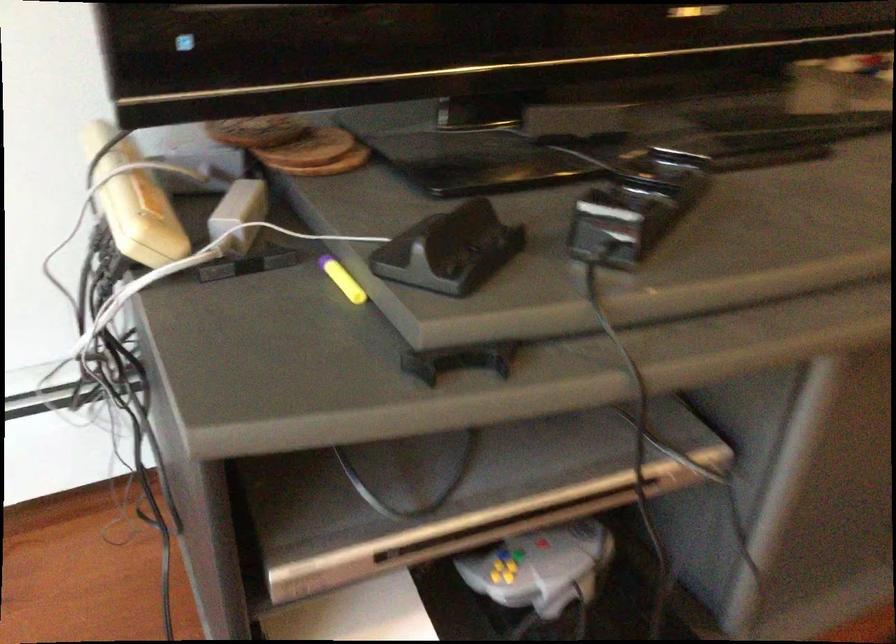
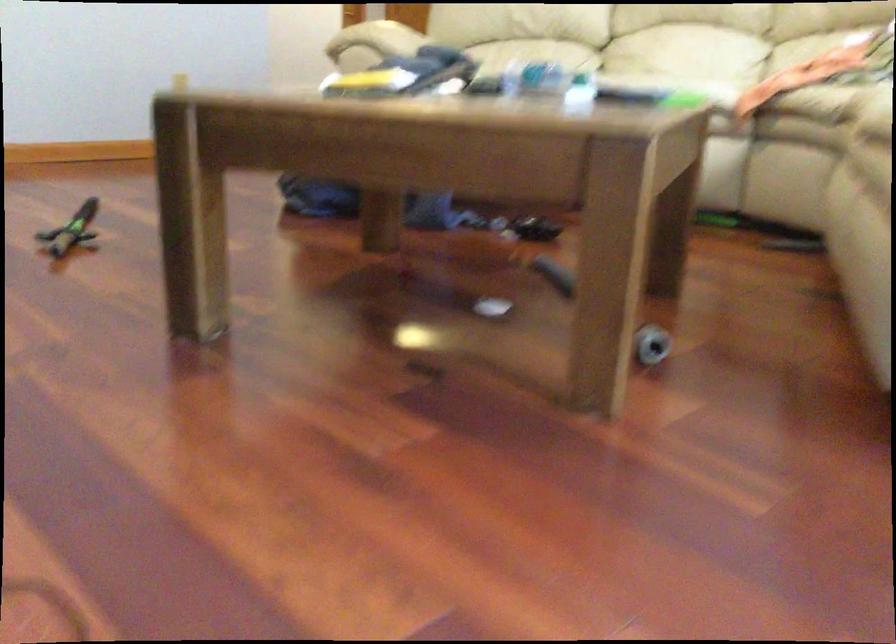
The first image is from the beginning of the video and the second image is from the end. How did the camera likely rotate when shooting the video?

The camera rotated toward right-down.